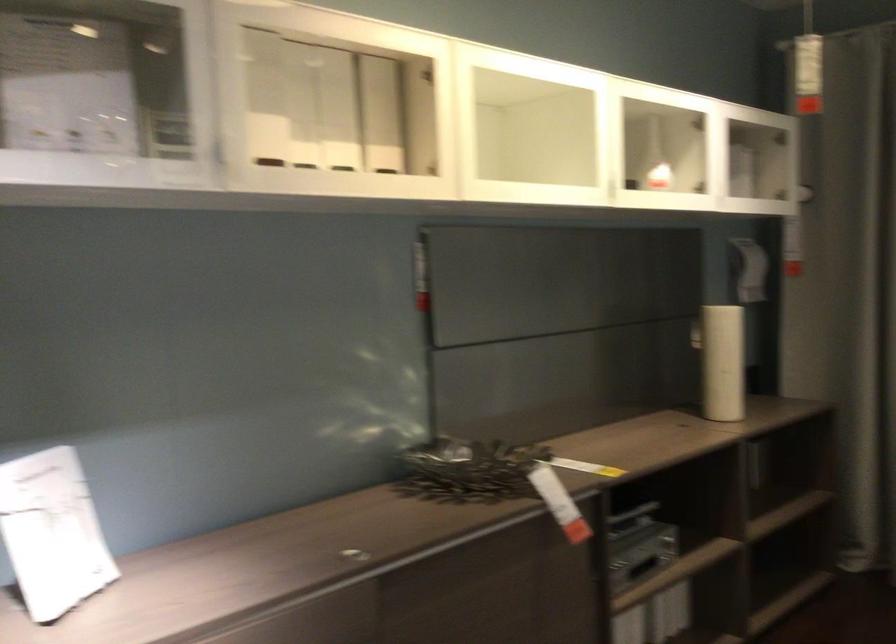
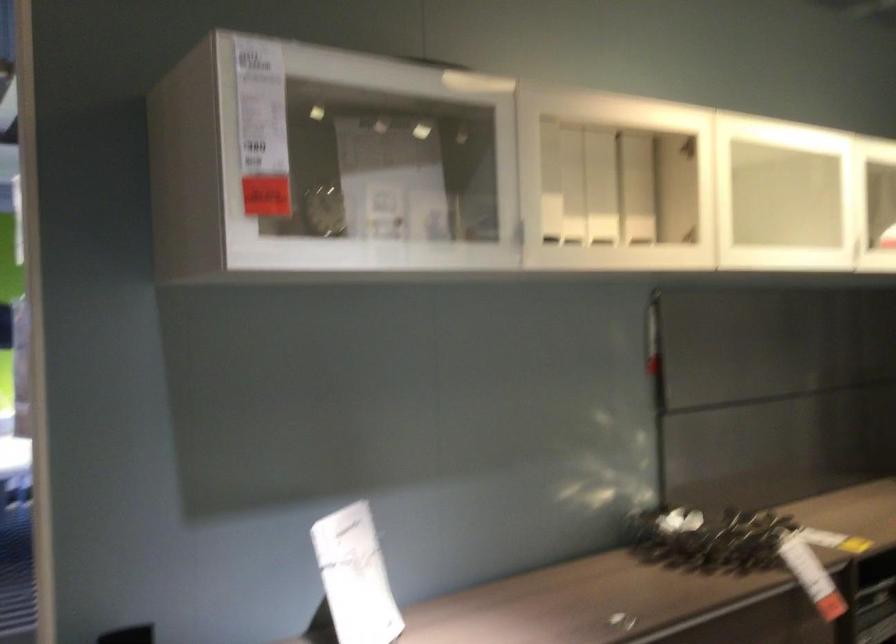
The point at (309,106) is marked in the first image. Where is the corresponding point in the second image?

(573, 184)